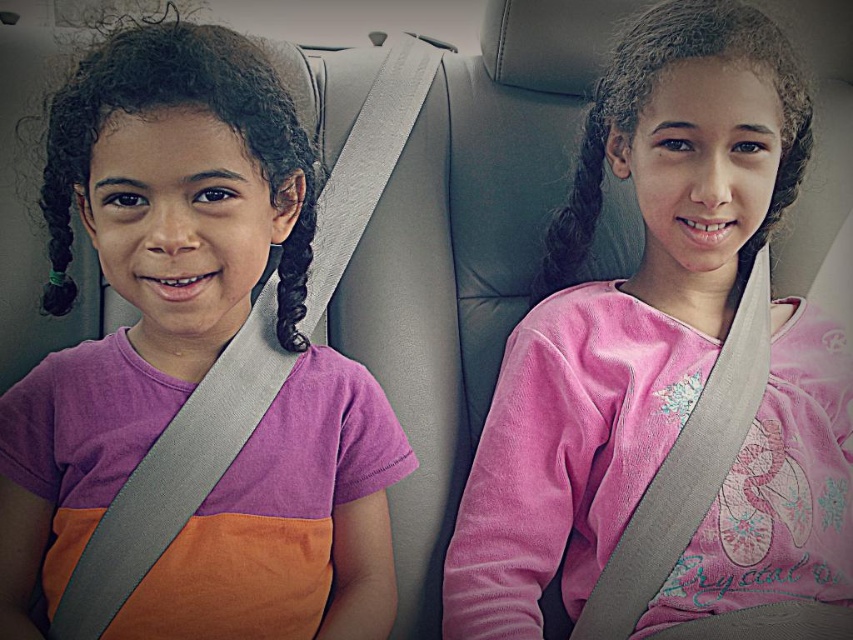
You are sitting in the driver seat of the car and want to hand a small toy to the girl on the left. The toy is placed at point with coordinate point (173,289). Can you reach it without moving from your seat?

The distance of point (173,289) from viewer is 27.67 inches, so yes, you can reach it from the driver seat since it is within a typical arm reach distance.

Based on the photo, you are a photographer taking a picture of the matte purple shirt at left and the pink velvety shirt at center. Which shirt is located to the left of the other?

The matte purple shirt at left is positioned on the left side of the pink velvety shirt at center, so it is to the left of the other.

You are a photographer taking a picture of two girls in a car. You notice the matte purple shirt at left and the pink velvety shirt at center. Which shirt is positioned lower in the image?

The matte purple shirt at left is below the pink velvety shirt at center, so it is positioned lower in the image.